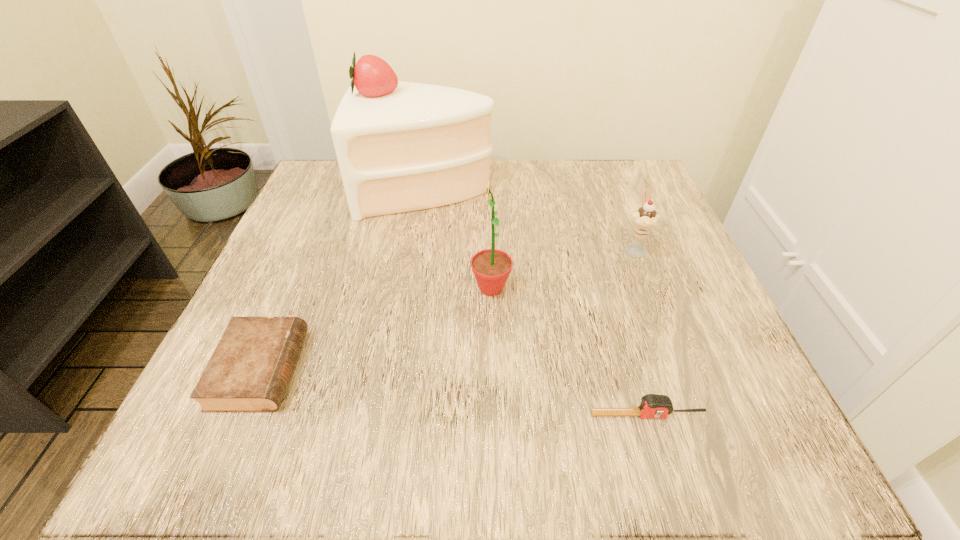
Where is `the third closest object to the tape measure`? The width and height of the screenshot is (960, 540). the third closest object to the tape measure is located at coordinates (249, 371).

Point out which object is positioned as the third nearest to the tallest object. Please provide its 2D coordinates. Your answer should be formatted as a tuple, i.e. [(x, y)], where the tuple contains the x and y coordinates of a point satisfying the conditions above.

[(249, 371)]

Image resolution: width=960 pixels, height=540 pixels. In order to click on vacant space that satisfies the following two spatial constraints: 1. on the spine side of the tape measure; 2. on the left side of the diary in this screenshot , I will do `click(241, 415)`.

In order to click on blank area in the image that satisfies the following two spatial constraints: 1. on the front side of the tallest object; 2. on the spine side of the leftmost object in this screenshot , I will do `click(399, 369)`.

Identify the location of vacant space that satisfies the following two spatial constraints: 1. on the front side of the third tallest object; 2. on the spine side of the diary. (x=681, y=369).

Locate an element on the screen. This screenshot has width=960, height=540. vacant position in the image that satisfies the following two spatial constraints: 1. on the back side of the second farthest object; 2. on the right side of the tape measure is located at coordinates [598, 248].

Identify the location of vacant space that satisfies the following two spatial constraints: 1. on the front side of the icecream; 2. on the spine side of the diary. (681, 369).

Where is `free location that satisfies the following two spatial constraints: 1. on the spine side of the diary; 2. on the left side of the tape measure`? The height and width of the screenshot is (540, 960). free location that satisfies the following two spatial constraints: 1. on the spine side of the diary; 2. on the left side of the tape measure is located at coordinates coord(241,415).

Where is `free space that satisfies the following two spatial constraints: 1. on the spine side of the diary; 2. on the back side of the tape measure`? The height and width of the screenshot is (540, 960). free space that satisfies the following two spatial constraints: 1. on the spine side of the diary; 2. on the back side of the tape measure is located at coordinates click(x=241, y=415).

Locate an element on the screen. The image size is (960, 540). vacant position in the image that satisfies the following two spatial constraints: 1. on the front side of the cake; 2. on the left side of the third shortest object is located at coordinates (419, 248).